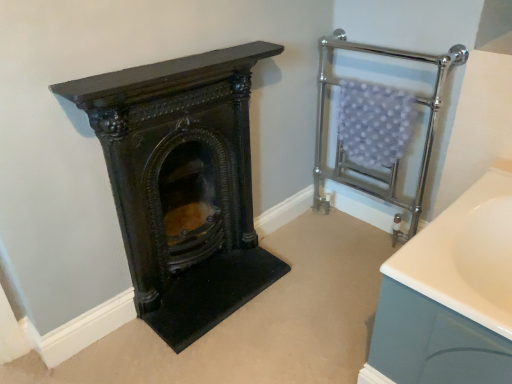
What do you see at coordinates (376, 125) in the screenshot?
I see `chrome metallic towel rack at upper right` at bounding box center [376, 125].

Locate an element on the screen. The image size is (512, 384). chrome metallic towel rack at upper right is located at coordinates (376, 125).

Identify the location of dark brown wood at left. (183, 184).

The height and width of the screenshot is (384, 512). Describe the element at coordinates (183, 184) in the screenshot. I see `dark brown wood at left` at that location.

Image resolution: width=512 pixels, height=384 pixels. I want to click on chrome metallic towel rack at upper right, so click(x=376, y=125).

Considering the relative positions of dark brown wood at left and chrome metallic towel rack at upper right in the image provided, is dark brown wood at left to the left of chrome metallic towel rack at upper right from the viewer's perspective?

Yes, dark brown wood at left is to the left of chrome metallic towel rack at upper right.

Considering the positions of objects dark brown wood at left and chrome metallic towel rack at upper right in the image provided, who is in front, dark brown wood at left or chrome metallic towel rack at upper right?

dark brown wood at left.

Is point (199, 61) more distant than point (325, 72)?

No, it is not.

From the image's perspective, who appears lower, dark brown wood at left or chrome metallic towel rack at upper right?

dark brown wood at left, from the image's perspective.

From a real-world perspective, does dark brown wood at left sit lower than chrome metallic towel rack at upper right?

Yes, from a real-world perspective, dark brown wood at left is below chrome metallic towel rack at upper right.

Considering the relative sizes of dark brown wood at left and chrome metallic towel rack at upper right in the image provided, is dark brown wood at left thinner than chrome metallic towel rack at upper right?

Correct, the width of dark brown wood at left is less than that of chrome metallic towel rack at upper right.

Who is shorter, dark brown wood at left or chrome metallic towel rack at upper right?

dark brown wood at left is shorter.

Can you confirm if dark brown wood at left is smaller than chrome metallic towel rack at upper right?

Yes, dark brown wood at left is smaller than chrome metallic towel rack at upper right.

Is dark brown wood at left located outside chrome metallic towel rack at upper right?

Absolutely, dark brown wood at left is external to chrome metallic towel rack at upper right.

Is dark brown wood at left placed right next to chrome metallic towel rack at upper right?

There is a gap between dark brown wood at left and chrome metallic towel rack at upper right.

Is chrome metallic towel rack at upper right at the back of dark brown wood at left?

No, dark brown wood at left is not facing the opposite direction of chrome metallic towel rack at upper right.

How distant is dark brown wood at left from chrome metallic towel rack at upper right?

dark brown wood at left and chrome metallic towel rack at upper right are 25.59 inches apart.

Where is `balustrade that appears above the dark brown wood at left (from a real-world perspective)`? balustrade that appears above the dark brown wood at left (from a real-world perspective) is located at coordinates (376, 125).

Considering the positions of objects chrome metallic towel rack at upper right and dark brown wood at left in the image provided, who is more to the right, chrome metallic towel rack at upper right or dark brown wood at left?

From the viewer's perspective, chrome metallic towel rack at upper right appears more on the right side.

Is chrome metallic towel rack at upper right behind dark brown wood at left?

That is True.

Between point (381, 140) and point (228, 264), which one is positioned behind?

The point (228, 264) is more distant.

From the image's perspective, which object appears higher, chrome metallic towel rack at upper right or dark brown wood at left?

chrome metallic towel rack at upper right.

From a real-world perspective, is chrome metallic towel rack at upper right above or below dark brown wood at left?

chrome metallic towel rack at upper right is above dark brown wood at left.

Considering the relative sizes of chrome metallic towel rack at upper right and dark brown wood at left in the image provided, is chrome metallic towel rack at upper right wider than dark brown wood at left?

Correct, the width of chrome metallic towel rack at upper right exceeds that of dark brown wood at left.

From their relative heights in the image, would you say chrome metallic towel rack at upper right is taller or shorter than dark brown wood at left?

Considering their sizes, chrome metallic towel rack at upper right has more height than dark brown wood at left.

Considering the sizes of chrome metallic towel rack at upper right and dark brown wood at left in the image, is chrome metallic towel rack at upper right bigger or smaller than dark brown wood at left?

Considering their sizes, chrome metallic towel rack at upper right takes up more space than dark brown wood at left.

Is chrome metallic towel rack at upper right spatially inside dark brown wood at left, or outside of it?

chrome metallic towel rack at upper right is spatially situated outside dark brown wood at left.

Are chrome metallic towel rack at upper right and dark brown wood at left making contact?

No, chrome metallic towel rack at upper right is not touching dark brown wood at left.

Is chrome metallic towel rack at upper right turned away from dark brown wood at left?

chrome metallic towel rack at upper right is not turned away from dark brown wood at left.

Locate an element on the screen. The height and width of the screenshot is (384, 512). wood burning stove beneath the chrome metallic towel rack at upper right (from a real-world perspective) is located at coordinates (183, 184).

At what (x,y) coordinates should I click in order to perform the action: click on wood burning stove in front of the chrome metallic towel rack at upper right. Please return your answer as a coordinate pair (x, y). Looking at the image, I should click on (183, 184).

At what (x,y) coordinates should I click in order to perform the action: click on wood burning stove that appears on the left of chrome metallic towel rack at upper right. Please return your answer as a coordinate pair (x, y). Looking at the image, I should click on (183, 184).